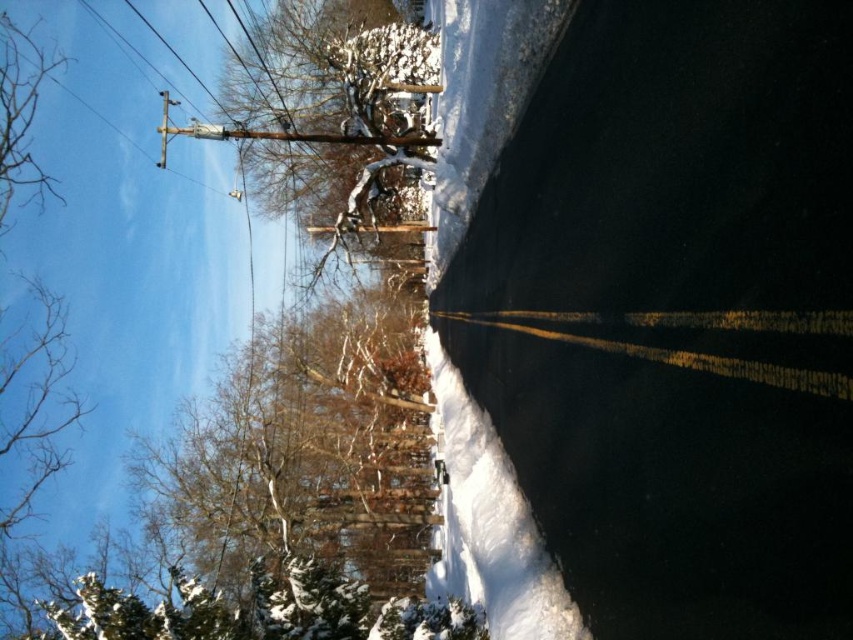
Question: From the image, what is the correct spatial relationship of brown textured tree at left in relation to snow-covered tree at upper center?

Choices:
 (A) below
 (B) above

Answer: (A)

Question: Where is brown textured tree at left located in relation to snow-covered tree at upper center in the image?

Choices:
 (A) left
 (B) right

Answer: (A)

Question: Which point is closer to the camera?

Choices:
 (A) snow-covered tree at upper center
 (B) brown textured tree at left

Answer: (A)

Question: Can you confirm if brown textured tree at left is bigger than snow-covered tree at upper center?

Choices:
 (A) no
 (B) yes

Answer: (B)